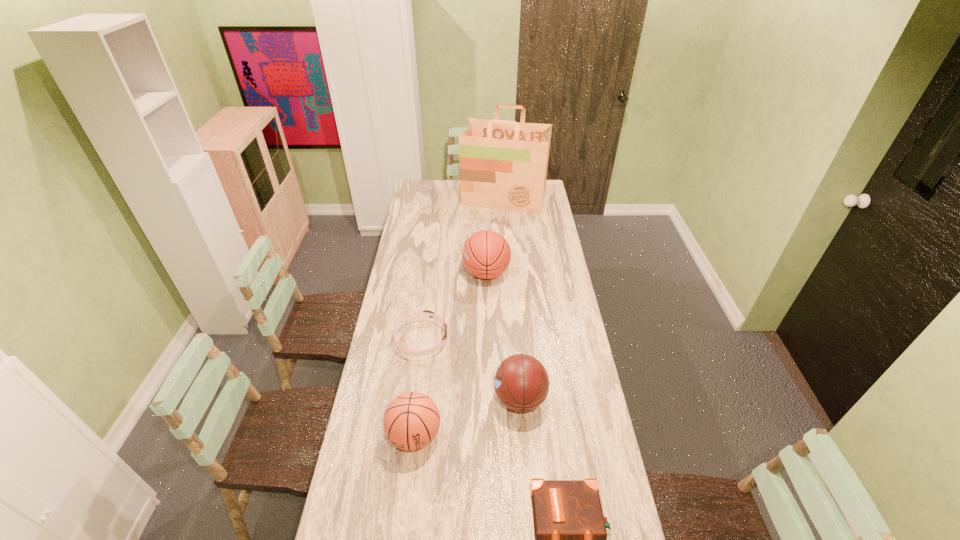
At what (x,y) coordinates should I click in order to perform the action: click on free space located 0.150m with the buckle on the fourth nearest object. Please return your answer as a coordinate pair (x, y). Image resolution: width=960 pixels, height=540 pixels. Looking at the image, I should click on pyautogui.click(x=483, y=339).

Identify the location of object situated at the far edge. (503, 164).

Where is `basketball positioned at the left edge`? basketball positioned at the left edge is located at coordinates (411, 421).

Where is `dog collar present at the left edge`? This screenshot has width=960, height=540. dog collar present at the left edge is located at coordinates (426, 313).

Where is `object situated at the right edge`? object situated at the right edge is located at coordinates (503, 164).

Identify the location of object at the far right corner. Image resolution: width=960 pixels, height=540 pixels. (503, 164).

Locate an element on the screen. The width and height of the screenshot is (960, 540). free space at the far edge is located at coordinates (455, 196).

Identify the location of free point at the left edge. This screenshot has height=540, width=960. (420, 255).

Locate an element on the screen. Image resolution: width=960 pixels, height=540 pixels. vacant space at the right edge is located at coordinates (535, 219).

At what (x,y) coordinates should I click in order to perform the action: click on free point between the fourth nearest object and the leftmost basketball. Please return your answer as a coordinate pair (x, y). Image resolution: width=960 pixels, height=540 pixels. Looking at the image, I should click on (418, 387).